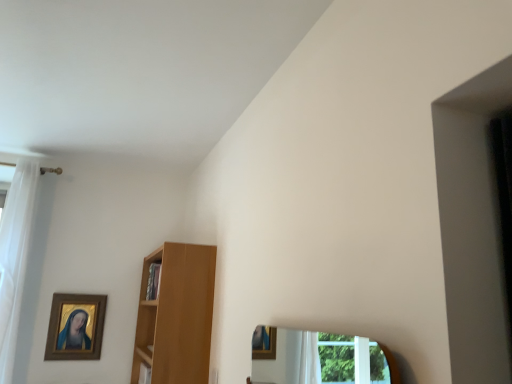
What do you see at coordinates (14, 257) in the screenshot? The width and height of the screenshot is (512, 384). I see `white sheer curtain at left` at bounding box center [14, 257].

What is the approximate height of white sheer curtain at left?

1.52 meters.

Find the location of a particular element. The height and width of the screenshot is (384, 512). gold-framed painting at upper left is located at coordinates (75, 327).

What is the approximate width of gold-framed painting at upper left?

gold-framed painting at upper left is 2.17 inches wide.

At what (x,y) coordinates should I click in order to perform the action: click on wooden cabinet at center. Please return your answer as a coordinate pair (x, y). This screenshot has width=512, height=384. Looking at the image, I should click on (151, 276).

Considering the positions of point (170, 359) and point (80, 347), is point (170, 359) closer or farther from the camera than point (80, 347)?

Point (170, 359).

Is light brown wooden shelf at center beside gold-framed painting at upper left?

No, light brown wooden shelf at center is not in contact with gold-framed painting at upper left.

Is light brown wooden shelf at center facing towards gold-framed painting at upper left?

Yes, light brown wooden shelf at center is aimed at gold-framed painting at upper left.

In terms of width, does light brown wooden shelf at center look wider or thinner when compared to gold-framed painting at upper left?

In the image, light brown wooden shelf at center appears to be wider than gold-framed painting at upper left.

Does gold-framed painting at upper left appear on the left side of wooden cabinet at center?

Yes.

From the picture: From the image's perspective, which one is positioned higher, gold-framed painting at upper left or wooden cabinet at center?

wooden cabinet at center.

Consider the image. In terms of height, does gold-framed painting at upper left look taller or shorter compared to wooden cabinet at center?

Clearly, gold-framed painting at upper left is taller compared to wooden cabinet at center.

Does gold-framed painting at upper left turn towards wooden cabinet at center?

No, gold-framed painting at upper left is not turned towards wooden cabinet at center.

Can you tell me how much gold-framed painting at upper left and light brown wooden shelf at center differ in facing direction?

There is a 88.8-degree angle between the facing directions of gold-framed painting at upper left and light brown wooden shelf at center.

Who is smaller, gold-framed painting at upper left or light brown wooden shelf at center?

gold-framed painting at upper left.

Is gold-framed painting at upper left surrounding light brown wooden shelf at center?

No, light brown wooden shelf at center is located outside of gold-framed painting at upper left.

The image size is (512, 384). What are the coordinates of `picture frame behind the white sheer curtain at left` in the screenshot? It's located at coord(75,327).

Are gold-framed painting at upper left and white sheer curtain at left far apart?

No, gold-framed painting at upper left is not far from white sheer curtain at left.

From the image's perspective, is gold-framed painting at upper left located beneath white sheer curtain at left?

Correct, gold-framed painting at upper left appears lower than white sheer curtain at left in the image.

Is gold-framed painting at upper left oriented away from white sheer curtain at left?

That's not correct — gold-framed painting at upper left is not looking away from white sheer curtain at left.

From a real-world perspective, is white sheer curtain at left physically below light brown wooden shelf at center?

No.

Can you see white sheer curtain at left touching light brown wooden shelf at center?

No, white sheer curtain at left is not with light brown wooden shelf at center.

Considering the relative sizes of white sheer curtain at left and light brown wooden shelf at center in the image provided, is white sheer curtain at left shorter than light brown wooden shelf at center?

No, white sheer curtain at left is not shorter than light brown wooden shelf at center.

Locate an element on the screen. cabinet on the left of the light brown wooden shelf at center is located at coordinates (151, 276).

Can light brown wooden shelf at center be found inside wooden cabinet at center?

No.

Is wooden cabinet at center oriented away from light brown wooden shelf at center?

Absolutely, wooden cabinet at center is directed away from light brown wooden shelf at center.

Consider the image. Who is shorter, wooden cabinet at center or white sheer curtain at left?

wooden cabinet at center is shorter.

From the image's perspective, is wooden cabinet at center below white sheer curtain at left?

Correct, wooden cabinet at center appears lower than white sheer curtain at left in the image.

In the image, is wooden cabinet at center positioned in front of or behind white sheer curtain at left?

In the image, wooden cabinet at center appears in front of white sheer curtain at left.

From a real-world perspective, is wooden cabinet at center over white sheer curtain at left?

No, from a real-world perspective, wooden cabinet at center is not on top of white sheer curtain at left.

Locate an element on the screen. Image resolution: width=512 pixels, height=384 pixels. shelf on the right of the gold-framed painting at upper left is located at coordinates (177, 316).

Locate an element on the screen. cabinet that appears above the gold-framed painting at upper left (from the image's perspective) is located at coordinates (151, 276).

Looking at this image, looking at the image, which one is located closer to white sheer curtain at left, light brown wooden shelf at center or gold-framed painting at upper left?

Among the two, gold-framed painting at upper left is located nearer to white sheer curtain at left.

Estimate the real-world distances between objects in this image. Which object is further from wooden cabinet at center, light brown wooden shelf at center or gold-framed painting at upper left?

gold-framed painting at upper left is further to wooden cabinet at center.

From the image, which object appears to be nearer to light brown wooden shelf at center, white sheer curtain at left or wooden cabinet at center?

Among the two, wooden cabinet at center is located nearer to light brown wooden shelf at center.

Estimate the real-world distances between objects in this image. Which object is further from light brown wooden shelf at center, wooden cabinet at center or white sheer curtain at left?

white sheer curtain at left is further to light brown wooden shelf at center.

Considering their positions, is light brown wooden shelf at center positioned closer to wooden cabinet at center than white sheer curtain at left?

light brown wooden shelf at center is closer to wooden cabinet at center.

Considering their positions, is light brown wooden shelf at center positioned further to gold-framed painting at upper left than white sheer curtain at left?

light brown wooden shelf at center is positioned further to the anchor gold-framed painting at upper left.

Looking at the image, which one is located closer to white sheer curtain at left, gold-framed painting at upper left or light brown wooden shelf at center?

gold-framed painting at upper left.

Considering their positions, is gold-framed painting at upper left positioned closer to light brown wooden shelf at center than white sheer curtain at left?

gold-framed painting at upper left is positioned closer to the anchor light brown wooden shelf at center.

Where is `cabinet between white sheer curtain at left and light brown wooden shelf at center in the horizontal direction`? The width and height of the screenshot is (512, 384). cabinet between white sheer curtain at left and light brown wooden shelf at center in the horizontal direction is located at coordinates (151, 276).

Find the location of a particular element. picture frame situated between white sheer curtain at left and light brown wooden shelf at center from left to right is located at coordinates (75, 327).

This screenshot has width=512, height=384. I want to click on cabinet between gold-framed painting at upper left and light brown wooden shelf at center, so click(151, 276).

This screenshot has height=384, width=512. In order to click on picture frame between white sheer curtain at left and wooden cabinet at center in the horizontal direction in this screenshot , I will do `click(75, 327)`.